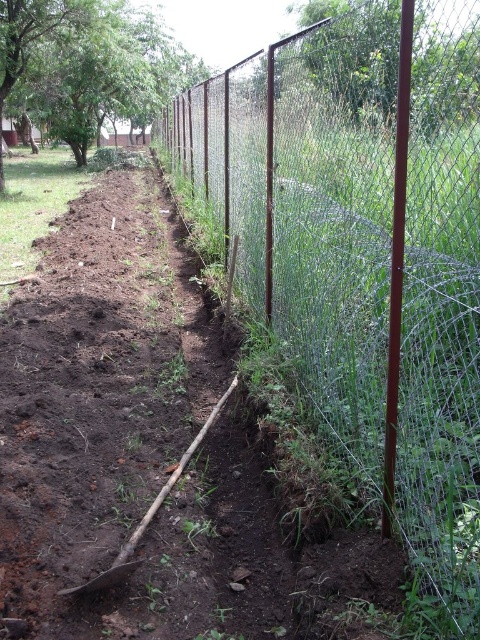
Based on the scene description, where is the wire mesh fence at center located in the image?

The wire mesh fence at center is located at point (x=364, y=248).

Based on the photo, you are standing at the point labeled as point (364, 248) in the image. What object are you facing directly?

The point labeled as point (364, 248) indicates the wire mesh fence at center, so you are facing the wire mesh fence at center directly.